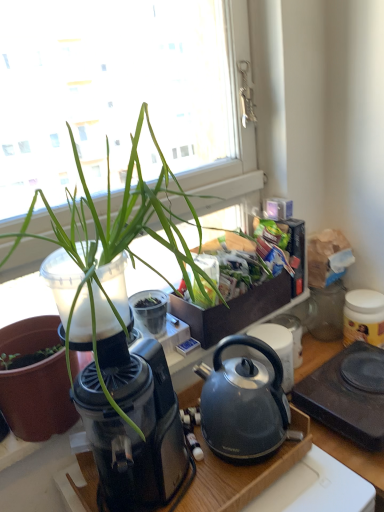
Question: From the image's perspective, is black plastic hot plate at lower right, arranged as the second appliance when viewed from the right, located above or below matte black pot at left?

Choices:
 (A) below
 (B) above

Answer: (A)

Question: Would you say black plastic hot plate at lower right, the 3th appliance in the left-to-right sequence, is to the left or to the right of matte black pot at left in the picture?

Choices:
 (A) left
 (B) right

Answer: (B)

Question: Which object is positioned farthest from the black plastic hot plate at lower right, arranged as the second appliance when viewed from the right?

Choices:
 (A) green leafy plant at upper left
 (B) matte black pot at left
 (C) satin black kettle at center
 (D) white plastic toaster at center, placed as the 3th appliance when sorted from right to left
 (E) transparent plastic coffee machine at left

Answer: (B)

Question: Considering the real-world distances, which object is farthest from the black plastic hot plate at lower right, the 3th appliance in the left-to-right sequence?

Choices:
 (A) green leafy vegetables at upper right
 (B) matte black pot at left
 (C) white plastic toaster at center, which appears as the second appliance when viewed from the left
 (D) yellow matte jar at right, which is counted as the first appliance, starting from the right
 (E) matte black kettle at center, the first appliance viewed from the left

Answer: (B)